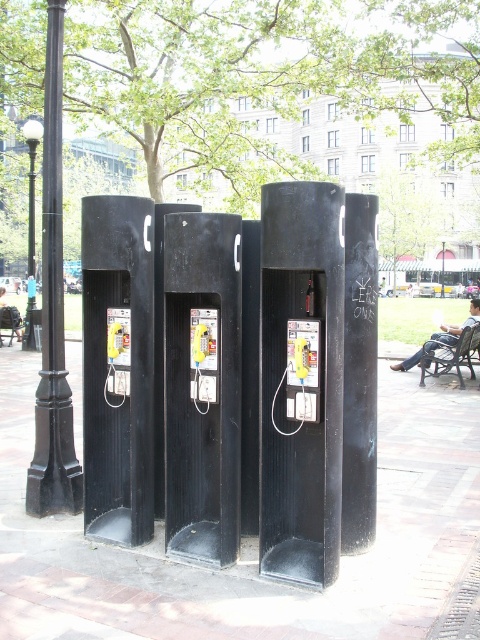
Is yellow matte payphone at center smaller than wooden park bench at center?

Correct, yellow matte payphone at center occupies less space than wooden park bench at center.

Does point (128, 316) come farther from viewer compared to point (17, 323)?

That is False.

At what (x,y) coordinates should I click in order to perform the action: click on yellow matte payphone at center. Please return your answer as a coordinate pair (x, y). The width and height of the screenshot is (480, 640). Looking at the image, I should click on (118, 355).

Identify the location of black polished metal pole at left. This screenshot has width=480, height=640. click(x=52, y=314).

Is the position of black polished metal pole at left less distant than that of black matte phone booth at center?

No, black polished metal pole at left is further to the viewer.

Is point (51, 173) less distant than point (360, 266)?

No.

Locate an element on the screen. black polished metal pole at left is located at coordinates (52, 314).

Consider the image. Between matte black payphone at center and black metal lamp post at left, which one has less height?

matte black payphone at center

Can you confirm if matte black payphone at center is wider than black metal lamp post at left?

Incorrect, matte black payphone at center's width does not surpass black metal lamp post at left's.

Describe the element at coordinates (204, 356) in the screenshot. I see `matte black payphone at center` at that location.

This screenshot has height=640, width=480. I want to click on matte black payphone at center, so click(x=204, y=356).